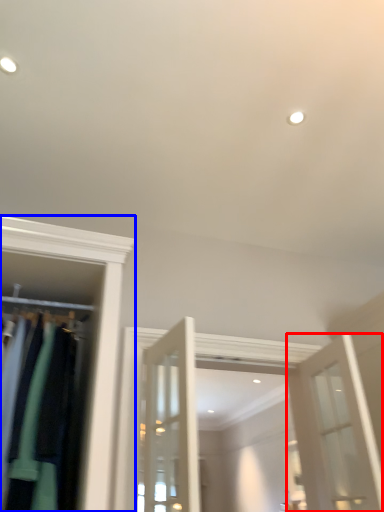
Question: Which object is closer to the camera taking this photo, door (highlighted by a red box) or closet (highlighted by a blue box)?

Choices:
 (A) door
 (B) closet

Answer: (B)